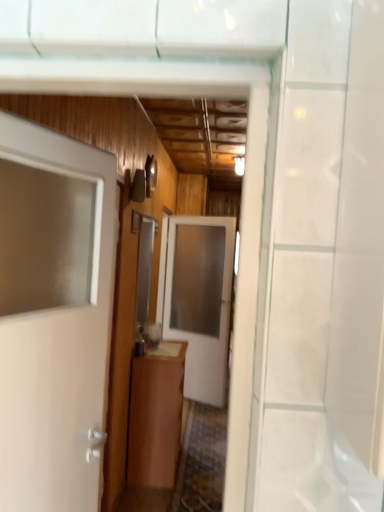
Locate an element on the screen. Image resolution: width=384 pixels, height=512 pixels. brown wood cabinet at center is located at coordinates (156, 416).

The image size is (384, 512). I want to click on white glossy door at center, the 2th door positioned from the front, so click(x=200, y=300).

Is brown wood cabinet at center placed right next to white glossy door at left, marked as the second door in a back-to-front arrangement?

brown wood cabinet at center is not next to white glossy door at left, marked as the second door in a back-to-front arrangement, and they're not touching.

Looking at this image, between brown wood cabinet at center and white glossy door at left, which is the 1th door in front-to-back order, which one appears on the left side from the viewer's perspective?

white glossy door at left, which is the 1th door in front-to-back order, is more to the left.

From a real-world perspective, is brown wood cabinet at center above or below white glossy door at left, which is the 1th door in front-to-back order?

brown wood cabinet at center is situated lower than white glossy door at left, which is the 1th door in front-to-back order, in the real world.

Looking at their sizes, would you say brown wood cabinet at center is wider or thinner than white glossy door at left, marked as the second door in a back-to-front arrangement?

Considering their sizes, brown wood cabinet at center looks broader than white glossy door at left, marked as the second door in a back-to-front arrangement.

From the image's perspective, does brown wood cabinet at center appear higher than white glossy door at center, arranged as the first door when viewed from the back?

No, from the image's perspective, brown wood cabinet at center is not above white glossy door at center, arranged as the first door when viewed from the back.

Is brown wood cabinet at center turned away from white glossy door at center, arranged as the first door when viewed from the back?

No, white glossy door at center, arranged as the first door when viewed from the back, is not at the back of brown wood cabinet at center.

Where is `cabinetry on the left of white glossy door at center, the 2th door positioned from the front`? This screenshot has height=512, width=384. cabinetry on the left of white glossy door at center, the 2th door positioned from the front is located at coordinates (156, 416).

From a real-world perspective, count 1st doors upward from the brown wood cabinet at center and point to it. Please provide its 2D coordinates.

[(200, 300)]

Is white glossy door at center, the 2th door positioned from the front, next to brown wood cabinet at center?

No, white glossy door at center, the 2th door positioned from the front, is not making contact with brown wood cabinet at center.

Considering the positions of objects white glossy door at center, arranged as the first door when viewed from the back, and brown wood cabinet at center in the image provided, who is more to the right, white glossy door at center, arranged as the first door when viewed from the back, or brown wood cabinet at center?

Positioned to the right is white glossy door at center, arranged as the first door when viewed from the back.

Between white glossy door at center, arranged as the first door when viewed from the back, and brown wood cabinet at center, which one has smaller width?

white glossy door at center, arranged as the first door when viewed from the back.

What are the coordinates of `door in front of the white glossy door at center, the 2th door positioned from the front` in the screenshot? It's located at (57, 343).

Does white glossy door at left, marked as the second door in a back-to-front arrangement, come in front of white glossy door at center, the 2th door positioned from the front?

Yes, white glossy door at left, marked as the second door in a back-to-front arrangement, is closer to the viewer.

From a real-world perspective, which is physically above, white glossy door at left, which is the 1th door in front-to-back order, or white glossy door at center, arranged as the first door when viewed from the back?

From a 3D spatial view, white glossy door at left, which is the 1th door in front-to-back order, is above.

Does white glossy door at left, which is the 1th door in front-to-back order, turn towards white glossy door at center, the 2th door positioned from the front?

No, white glossy door at left, which is the 1th door in front-to-back order, is not facing towards white glossy door at center, the 2th door positioned from the front.

Consider the image. Is white glossy door at center, arranged as the first door when viewed from the back, aimed at white glossy door at left, which is the 1th door in front-to-back order?

No, white glossy door at center, arranged as the first door when viewed from the back, is not turned towards white glossy door at left, which is the 1th door in front-to-back order.

Is white glossy door at center, the 2th door positioned from the front, bigger than white glossy door at left, which is the 1th door in front-to-back order?

Correct, white glossy door at center, the 2th door positioned from the front, is larger in size than white glossy door at left, which is the 1th door in front-to-back order.

Is white glossy door at center, arranged as the first door when viewed from the back, to the right of white glossy door at left, marked as the second door in a back-to-front arrangement, from the viewer's perspective?

Correct, you'll find white glossy door at center, arranged as the first door when viewed from the back, to the right of white glossy door at left, marked as the second door in a back-to-front arrangement.

Between white glossy door at left, which is the 1th door in front-to-back order, and brown wood cabinet at center, which one has smaller size?

Smaller between the two is white glossy door at left, which is the 1th door in front-to-back order.

In terms of height, does white glossy door at left, which is the 1th door in front-to-back order, look taller or shorter compared to brown wood cabinet at center?

In the image, white glossy door at left, which is the 1th door in front-to-back order, appears to be taller than brown wood cabinet at center.

From the image's perspective, between white glossy door at left, marked as the second door in a back-to-front arrangement, and brown wood cabinet at center, which one is located above?

white glossy door at left, marked as the second door in a back-to-front arrangement, from the image's perspective.

From a real-world perspective, which is physically above, white glossy door at left, which is the 1th door in front-to-back order, or brown wood cabinet at center?

In real-world perspective, white glossy door at left, which is the 1th door in front-to-back order, is above.

You are a GUI agent. You are given a task and a screenshot of the screen. Output one action in this format:
    pyautogui.click(x=<x>, y=<y>)
    Task: Click on the cabinetry on the right side of white glossy door at left, which is the 1th door in front-to-back order
    The height and width of the screenshot is (512, 384).
    Given the screenshot: What is the action you would take?
    [x=156, y=416]

Locate an element on the screen. The height and width of the screenshot is (512, 384). the 1st door positioned above the brown wood cabinet at center (from the image's perspective) is located at coordinates (200, 300).

Looking at the image, which one is located further to white glossy door at left, which is the 1th door in front-to-back order, white glossy door at center, the 2th door positioned from the front, or brown wood cabinet at center?

Based on the image, white glossy door at center, the 2th door positioned from the front, appears to be further to white glossy door at left, which is the 1th door in front-to-back order.

Based on their spatial positions, is brown wood cabinet at center or white glossy door at center, the 2th door positioned from the front, further from white glossy door at left, marked as the second door in a back-to-front arrangement?

The object further to white glossy door at left, marked as the second door in a back-to-front arrangement, is white glossy door at center, the 2th door positioned from the front.

From the image, which object appears to be farther from white glossy door at center, the 2th door positioned from the front, white glossy door at left, marked as the second door in a back-to-front arrangement, or brown wood cabinet at center?

white glossy door at left, marked as the second door in a back-to-front arrangement, is further to white glossy door at center, the 2th door positioned from the front.

Consider the image. Looking at the image, which one is located further to white glossy door at center, the 2th door positioned from the front, brown wood cabinet at center or white glossy door at left, which is the 1th door in front-to-back order?

Based on the image, white glossy door at left, which is the 1th door in front-to-back order, appears to be further to white glossy door at center, the 2th door positioned from the front.

From the image, which object appears to be farther from brown wood cabinet at center, white glossy door at center, the 2th door positioned from the front, or white glossy door at left, marked as the second door in a back-to-front arrangement?

The object further to brown wood cabinet at center is white glossy door at left, marked as the second door in a back-to-front arrangement.

Looking at this image, considering their positions, is white glossy door at left, which is the 1th door in front-to-back order, positioned closer to brown wood cabinet at center than white glossy door at center, arranged as the first door when viewed from the back?

Among the two, white glossy door at center, arranged as the first door when viewed from the back, is located nearer to brown wood cabinet at center.

At what (x,y) coordinates should I click in order to perform the action: click on cabinetry positioned between white glossy door at left, marked as the second door in a back-to-front arrangement, and white glossy door at center, arranged as the first door when viewed from the back, from near to far. Please return your answer as a coordinate pair (x, y). The height and width of the screenshot is (512, 384). Looking at the image, I should click on (156, 416).